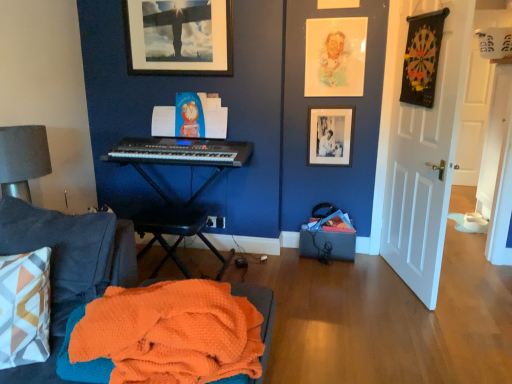
The image size is (512, 384). I want to click on vacant space in between white matte door at right and black fabric box at lower right, so click(x=365, y=279).